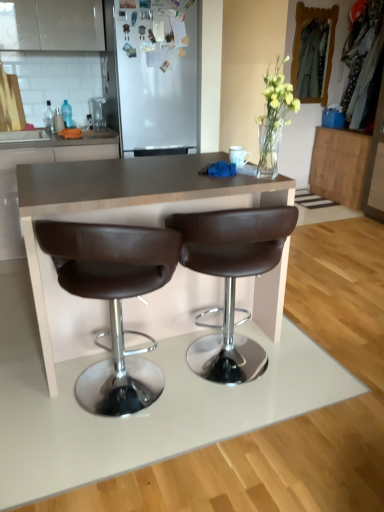
Question: Should I look upward or downward to see brown leather cabinet at center, placed as the 2th cabinetry when sorted from back to front?

Choices:
 (A) up
 (B) down

Answer: (A)

Question: Is brown leather stool at center, positioned as the first chair in left-to-right order, further to the viewer compared to wooden cabinet at right, which ranks as the 2th cabinetry in front-to-back order?

Choices:
 (A) no
 (B) yes

Answer: (A)

Question: Can you confirm if brown leather stool at center, acting as the second chair starting from the right, is positioned to the right of wooden cabinet at right, which ranks as the 2th cabinetry in front-to-back order?

Choices:
 (A) yes
 (B) no

Answer: (B)

Question: Is brown leather stool at center, acting as the second chair starting from the right, in front of wooden cabinet at right, which ranks as the 2th cabinetry in front-to-back order?

Choices:
 (A) yes
 (B) no

Answer: (A)

Question: From a real-world perspective, does brown leather stool at center, acting as the second chair starting from the right, stand above wooden cabinet at right, which ranks as the first cabinetry in right-to-left order?

Choices:
 (A) yes
 (B) no

Answer: (A)

Question: From the image's perspective, is brown leather stool at center, positioned as the first chair in left-to-right order, on wooden cabinet at right, which ranks as the 1th cabinetry in back-to-front order?

Choices:
 (A) yes
 (B) no

Answer: (B)

Question: Is brown leather stool at center, positioned as the first chair in left-to-right order, surrounding wooden cabinet at right, which ranks as the first cabinetry in right-to-left order?

Choices:
 (A) yes
 (B) no

Answer: (B)

Question: Does white matte refrigerator at upper center have a larger size compared to brown leather stool at center, acting as the second chair starting from the right?

Choices:
 (A) no
 (B) yes

Answer: (B)

Question: Is the depth of white matte refrigerator at upper center greater than that of brown leather stool at center, positioned as the first chair in left-to-right order?

Choices:
 (A) yes
 (B) no

Answer: (A)

Question: Can you confirm if white matte refrigerator at upper center is positioned to the right of brown leather stool at center, acting as the second chair starting from the right?

Choices:
 (A) no
 (B) yes

Answer: (A)

Question: Is the position of white matte refrigerator at upper center less distant than that of brown leather stool at center, positioned as the first chair in left-to-right order?

Choices:
 (A) yes
 (B) no

Answer: (B)

Question: Is white matte refrigerator at upper center outside of brown leather stool at center, positioned as the first chair in left-to-right order?

Choices:
 (A) yes
 (B) no

Answer: (A)

Question: From the image's perspective, does white matte refrigerator at upper center appear lower than brown leather stool at center, positioned as the first chair in left-to-right order?

Choices:
 (A) no
 (B) yes

Answer: (A)

Question: From a real-world perspective, is wooden cabinet at right, which ranks as the first cabinetry in right-to-left order, below brown leather cabinet at center, placed as the 2th cabinetry when sorted from back to front?

Choices:
 (A) no
 (B) yes

Answer: (B)